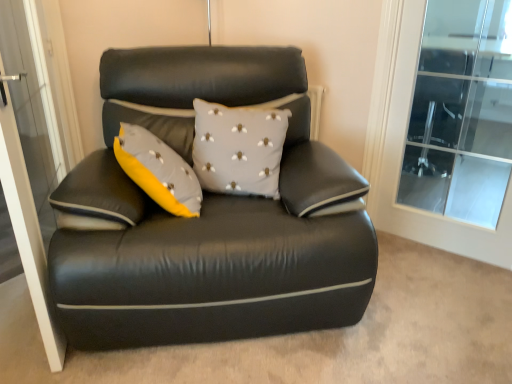
Question: Does transparent glass screen door at left appear on the left side of transparent glass door at upper right?

Choices:
 (A) no
 (B) yes

Answer: (B)

Question: Considering the relative positions of transparent glass screen door at left and transparent glass door at upper right in the image provided, is transparent glass screen door at left to the right of transparent glass door at upper right from the viewer's perspective?

Choices:
 (A) yes
 (B) no

Answer: (B)

Question: From a real-world perspective, is transparent glass screen door at left positioned over transparent glass door at upper right based on gravity?

Choices:
 (A) no
 (B) yes

Answer: (A)

Question: From the image's perspective, does transparent glass screen door at left appear higher than transparent glass door at upper right?

Choices:
 (A) yes
 (B) no

Answer: (B)

Question: Does transparent glass screen door at left have a lesser height compared to transparent glass door at upper right?

Choices:
 (A) yes
 (B) no

Answer: (B)

Question: Is transparent glass screen door at left positioned behind transparent glass door at upper right?

Choices:
 (A) yes
 (B) no

Answer: (B)

Question: Does black leather couch at center have a larger size compared to gray fabric cushion at center?

Choices:
 (A) no
 (B) yes

Answer: (B)

Question: Is black leather couch at center looking in the opposite direction of gray fabric cushion at center?

Choices:
 (A) no
 (B) yes

Answer: (B)

Question: Is black leather couch at center smaller than gray fabric cushion at center?

Choices:
 (A) yes
 (B) no

Answer: (B)

Question: Is black leather couch at center directly adjacent to gray fabric cushion at center?

Choices:
 (A) yes
 (B) no

Answer: (B)

Question: Is black leather couch at center not within gray fabric cushion at center?

Choices:
 (A) no
 (B) yes

Answer: (B)

Question: Is black leather couch at center at the right side of gray fabric cushion at center?

Choices:
 (A) yes
 (B) no

Answer: (B)

Question: Is transparent glass screen door at left at the left side of black leather couch at center?

Choices:
 (A) no
 (B) yes

Answer: (B)